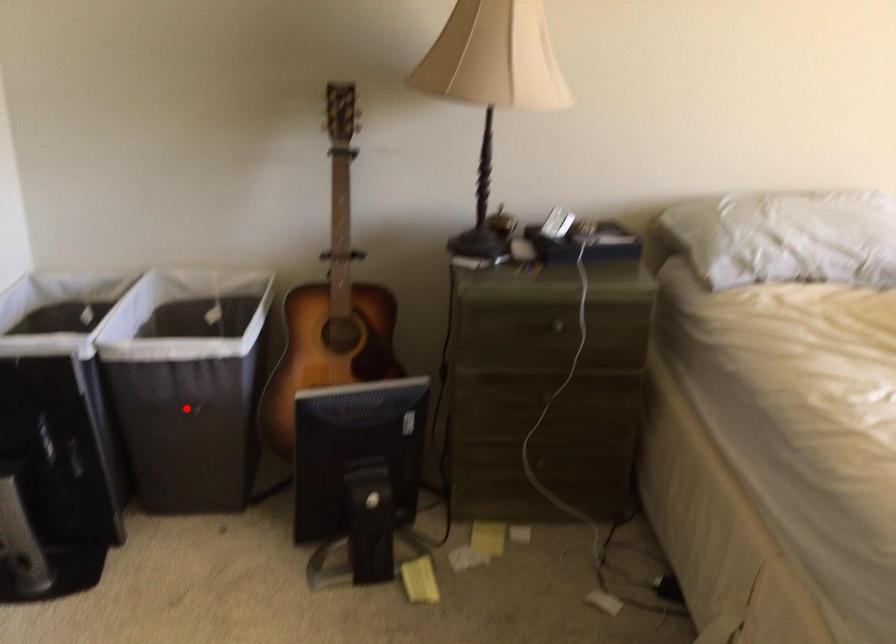
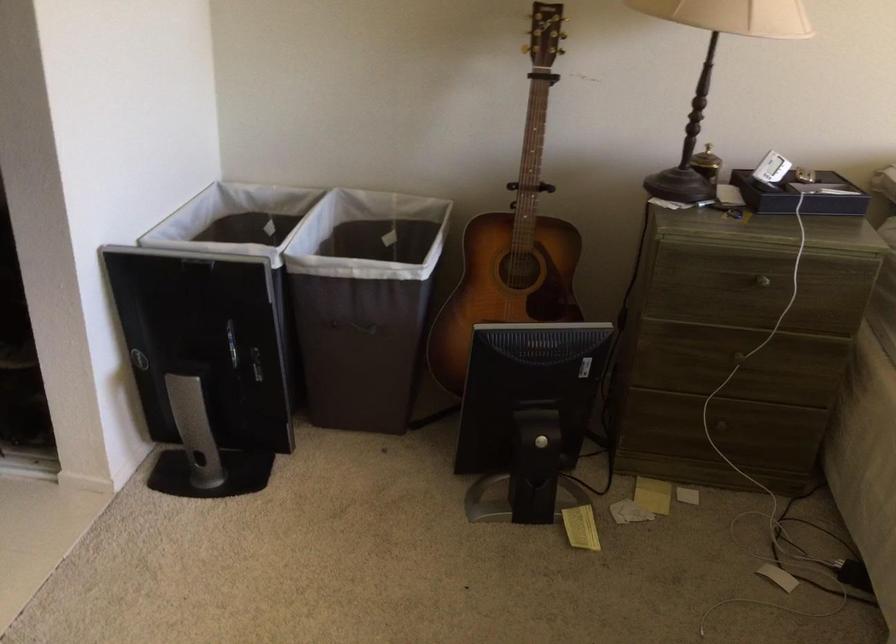
Question: I am providing you with two images of the same scene from different viewpoints. A red point is marked on the first image. At the location where the point appears in image 1, is it still visible in image 2?

Choices:
 (A) Yes
 (B) No

Answer: (A)